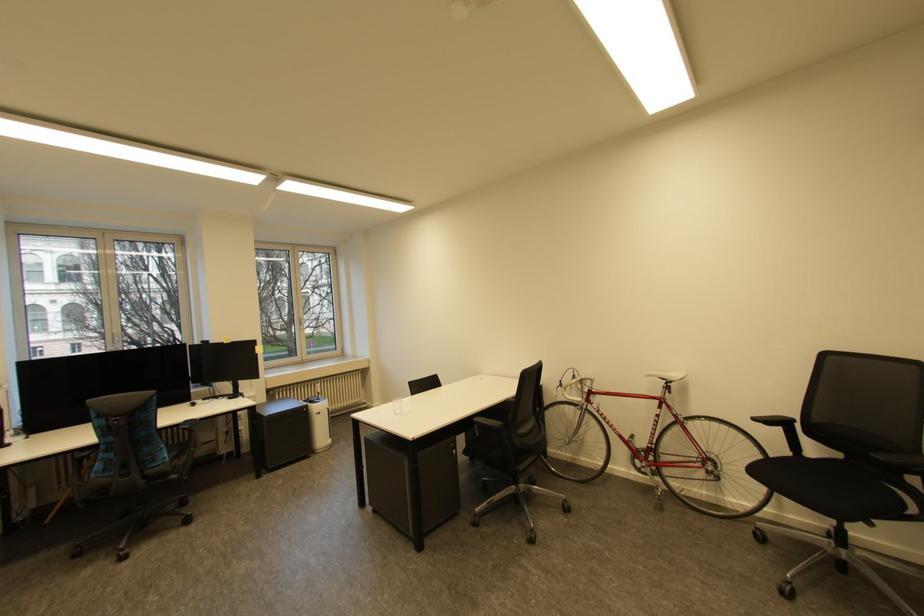
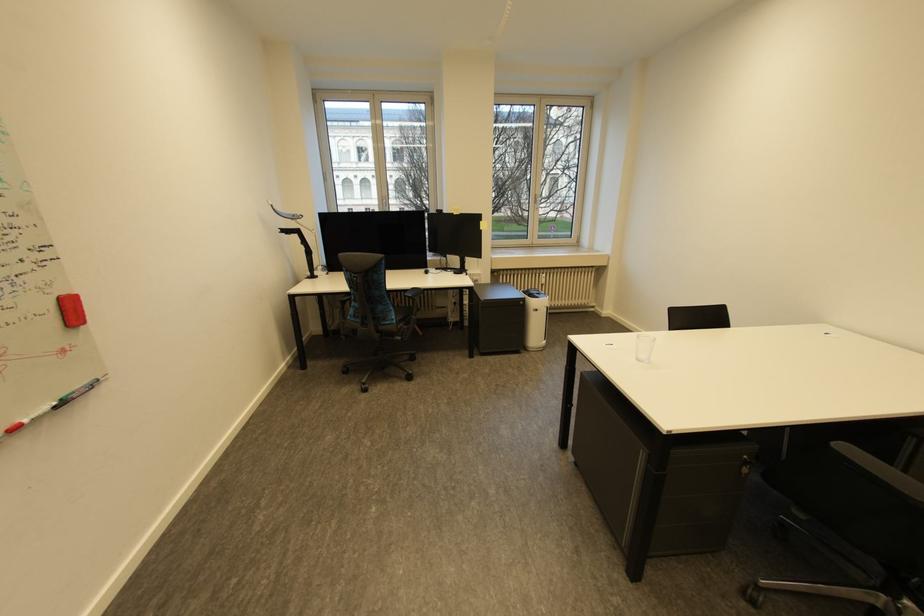
Locate, in the second image, the point that corresponds to the point at 479,528 in the first image.

(750, 604)